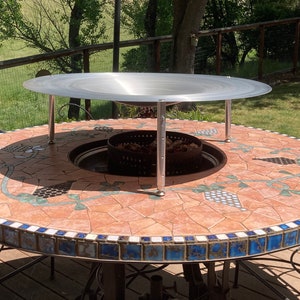
I want to click on silver color of table surface, so click(x=152, y=85).